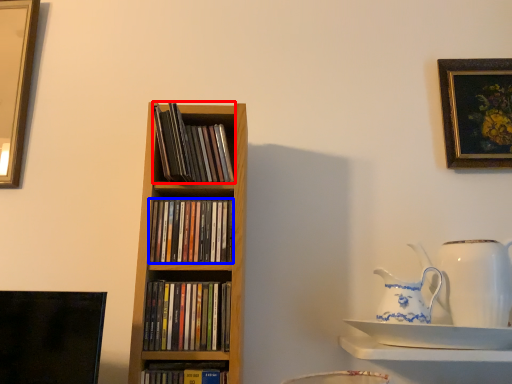
Question: Which object is closer to the camera taking this photo, book (highlighted by a red box) or book (highlighted by a blue box)?

Choices:
 (A) book
 (B) book

Answer: (B)